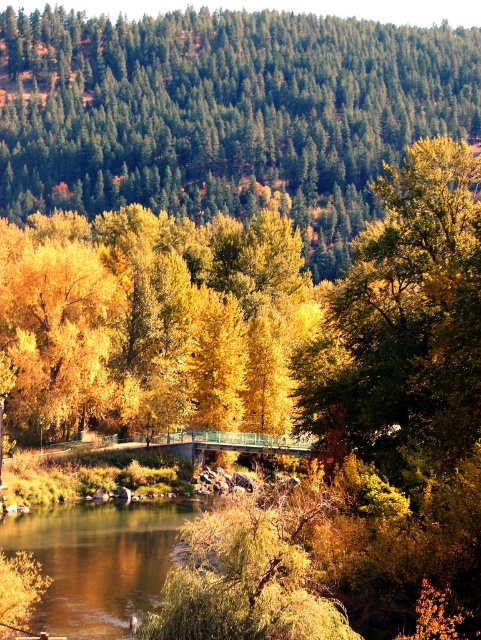
Question: Does yellow matte tree at upper center appear on the right side of brown smooth river at center?

Choices:
 (A) no
 (B) yes

Answer: (B)

Question: Which point is closer to the camera taking this photo?

Choices:
 (A) (146, 58)
 (B) (35, 314)
 (C) (50, 621)

Answer: (C)

Question: Is yellow matte tree at upper center thinner than yellow/golden leaves at center?

Choices:
 (A) no
 (B) yes

Answer: (A)

Question: Does yellow matte tree at upper center lie behind yellow/golden leaves at center?

Choices:
 (A) yes
 (B) no

Answer: (A)

Question: Estimate the real-world distances between objects in this image. Which object is closer to the yellow/golden leaves at center?

Choices:
 (A) yellow matte tree at upper center
 (B) brown smooth river at center

Answer: (B)

Question: Which object appears farthest from the camera in this image?

Choices:
 (A) yellow matte tree at upper center
 (B) brown smooth river at center
 (C) yellow/golden leaves at center

Answer: (A)